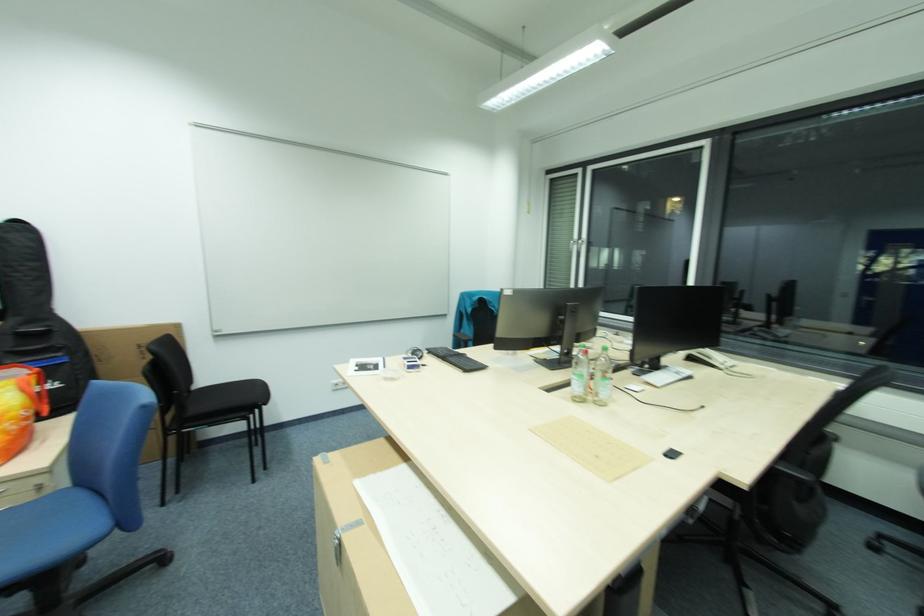
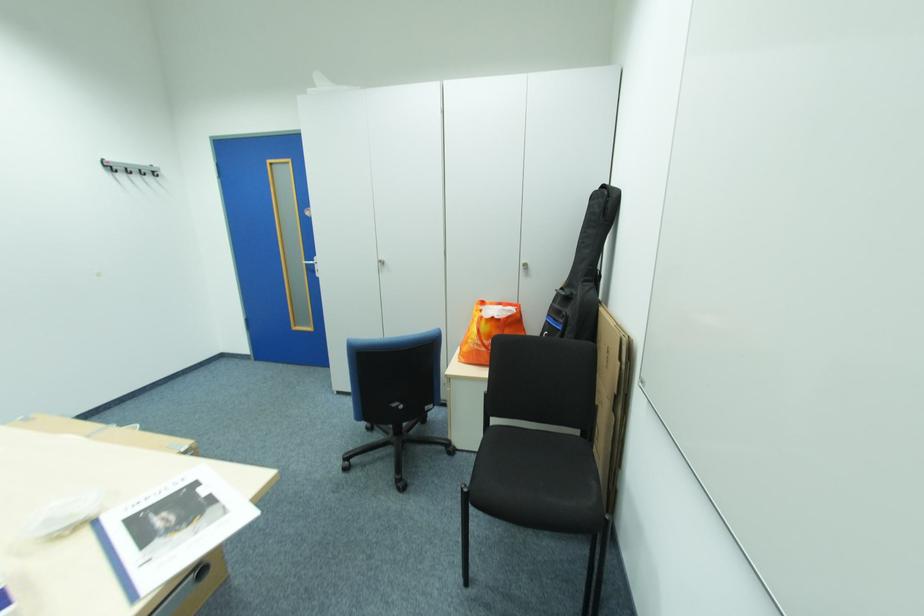
Where in the second image is the point corresponding to pixel 67 352 from the first image?

(572, 318)